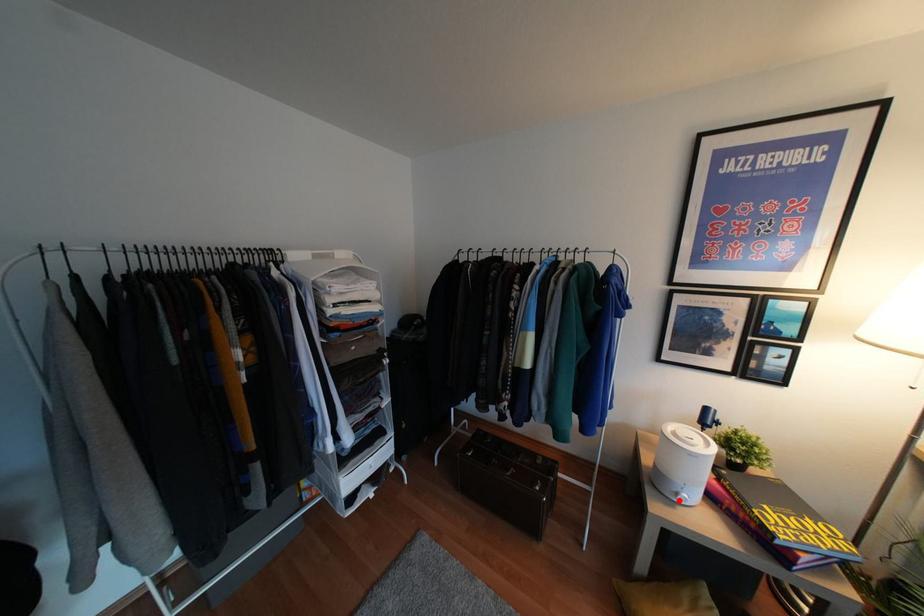
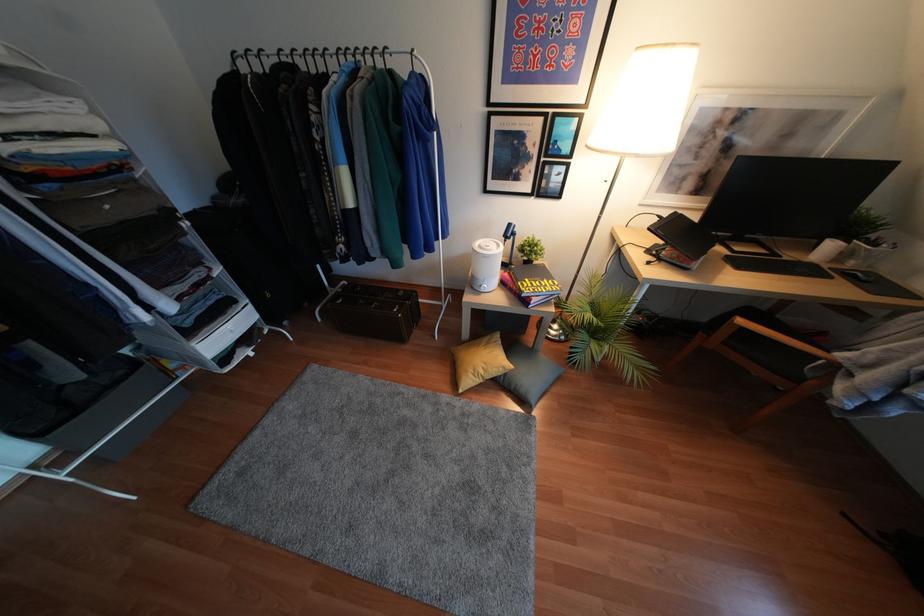
In the second image, find the point that corresponds to the highlighted location in the first image.

(481, 290)